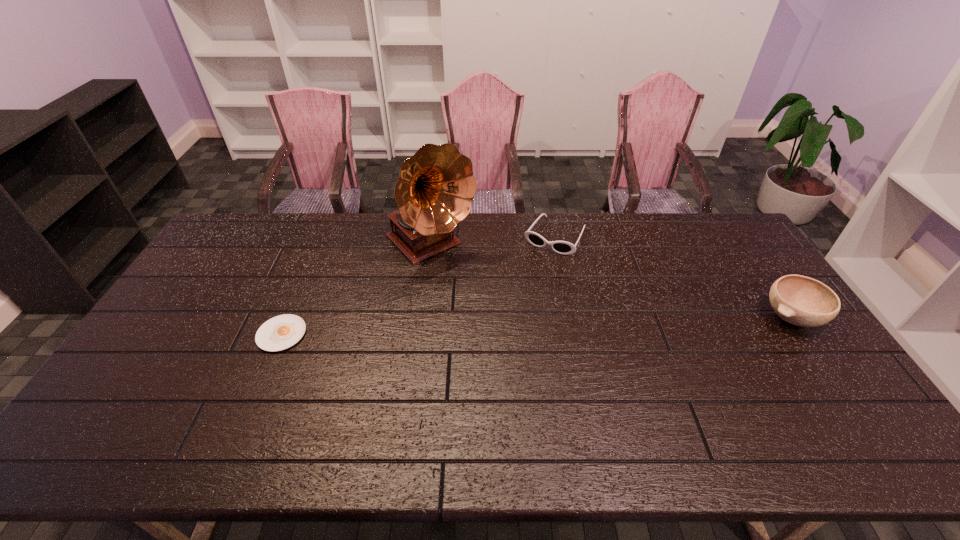
Where is `vacant area situated 0.370m with the lenses of the second shortest object facing outward`? The height and width of the screenshot is (540, 960). vacant area situated 0.370m with the lenses of the second shortest object facing outward is located at coordinates (498, 328).

Locate an element on the screen. This screenshot has width=960, height=540. vacant space located 0.090m with the lenses of the second shortest object facing outward is located at coordinates (534, 271).

I want to click on vacant space situated 0.390m with the lenses of the second shortest object facing outward, so click(495, 333).

At what (x,y) coordinates should I click in order to perform the action: click on vacant space situated on the horn of the phonograph_record. Please return your answer as a coordinate pair (x, y). This screenshot has height=540, width=960. Looking at the image, I should click on (501, 314).

Image resolution: width=960 pixels, height=540 pixels. Identify the location of free region located on the horn of the phonograph_record. (536, 348).

Identify the location of vacant space situated 0.290m on the horn of the phonograph_record. (512, 324).

Image resolution: width=960 pixels, height=540 pixels. Identify the location of sunglasses located in the far edge section of the desktop. (562, 247).

I want to click on phonograph_record positioned at the far edge, so click(x=436, y=186).

The height and width of the screenshot is (540, 960). I want to click on object present at the right edge, so click(x=802, y=301).

I want to click on blank space at the far edge, so click(345, 248).